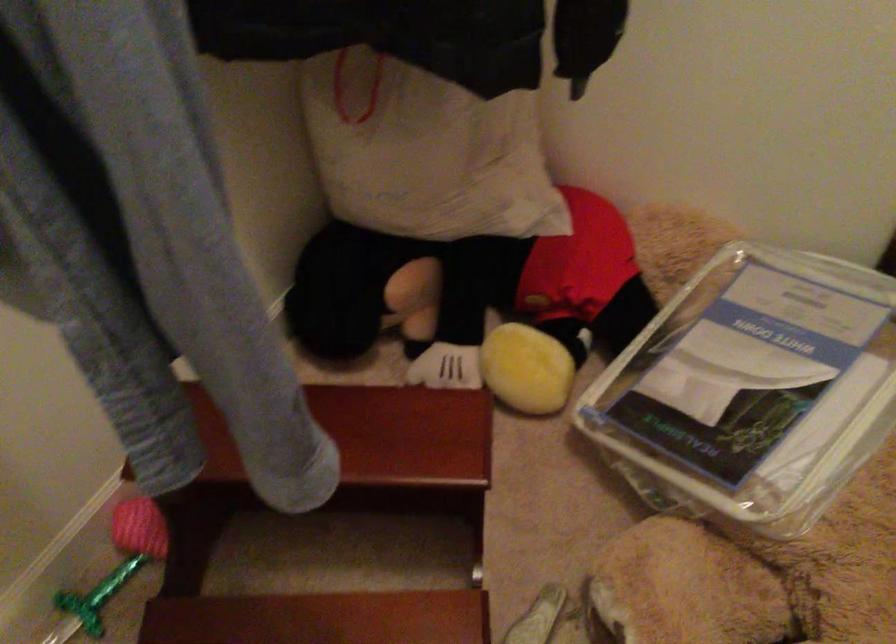
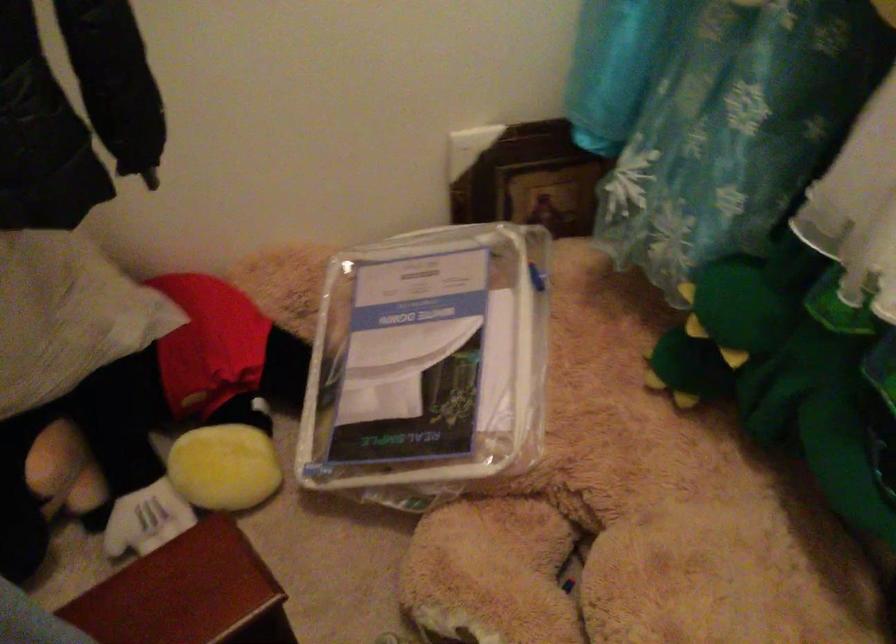
Question: The camera is either moving clockwise (left) or counter-clockwise (right) around the object. The first image is from the beginning of the video and the second image is from the end. Is the camera moving left or right when shooting the video?

Choices:
 (A) Left
 (B) Right

Answer: (A)